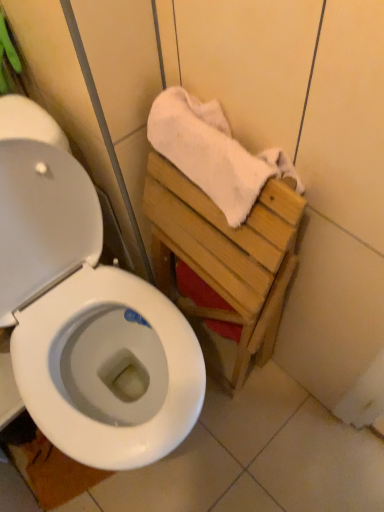
Question: Should I look upward or downward to see white glossy toilet seat at lower left?

Choices:
 (A) down
 (B) up

Answer: (A)

Question: From a real-world perspective, does white cotton towel at upper right stand above white glossy toilet seat at lower left?

Choices:
 (A) no
 (B) yes

Answer: (B)

Question: Can you confirm if white cotton towel at upper right is positioned to the right of white glossy toilet seat at lower left?

Choices:
 (A) no
 (B) yes

Answer: (B)

Question: Is white cotton towel at upper right touching white glossy toilet seat at lower left?

Choices:
 (A) yes
 (B) no

Answer: (B)

Question: Is white cotton towel at upper right oriented away from white glossy toilet seat at lower left?

Choices:
 (A) no
 (B) yes

Answer: (A)

Question: Does white cotton towel at upper right have a greater height compared to white glossy toilet seat at lower left?

Choices:
 (A) yes
 (B) no

Answer: (A)

Question: Can you confirm if white cotton towel at upper right is smaller than white glossy toilet seat at lower left?

Choices:
 (A) no
 (B) yes

Answer: (A)

Question: Is white glossy toilet seat at lower left positioned before white cotton towel at upper right?

Choices:
 (A) no
 (B) yes

Answer: (A)

Question: Can you confirm if white glossy toilet seat at lower left is positioned to the left of white cotton towel at upper right?

Choices:
 (A) yes
 (B) no

Answer: (A)

Question: Considering the relative positions of white glossy toilet seat at lower left and white cotton towel at upper right in the image provided, is white glossy toilet seat at lower left behind white cotton towel at upper right?

Choices:
 (A) yes
 (B) no

Answer: (A)

Question: Are white glossy toilet seat at lower left and white cotton towel at upper right beside each other?

Choices:
 (A) yes
 (B) no

Answer: (B)

Question: Would you say white glossy toilet seat at lower left is a long distance from white cotton towel at upper right?

Choices:
 (A) no
 (B) yes

Answer: (A)

Question: Can you confirm if white glossy toilet seat at lower left is positioned to the right of white cotton towel at upper right?

Choices:
 (A) no
 (B) yes

Answer: (A)

Question: In the image, is white glossy toilet seat at lower left on the left side or the right side of white cotton towel at upper right?

Choices:
 (A) right
 (B) left

Answer: (B)